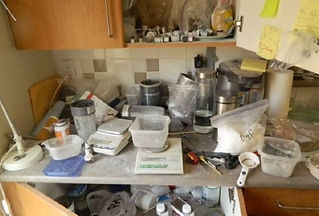
Where is `cutting board`? The width and height of the screenshot is (319, 216). cutting board is located at coordinates (41, 97).